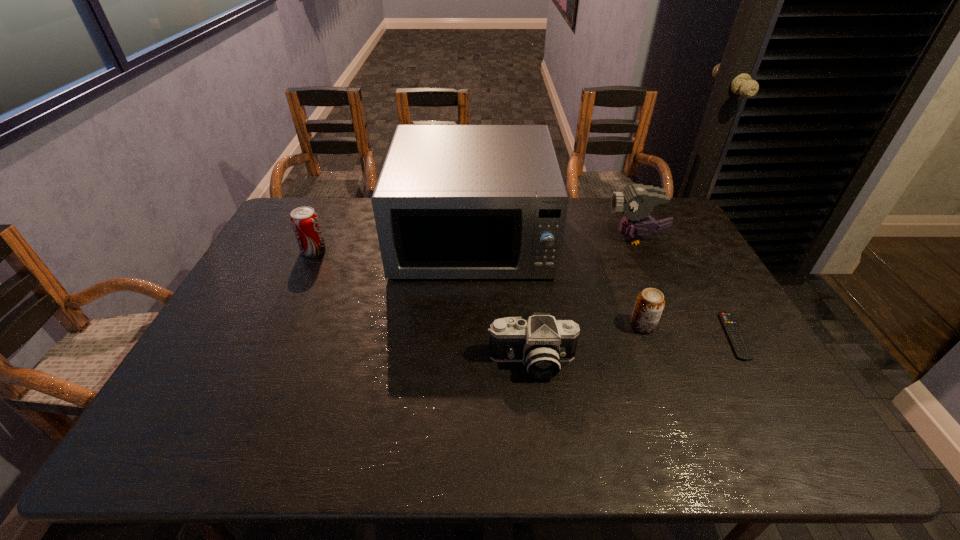
Where is `microwave oven`? The height and width of the screenshot is (540, 960). microwave oven is located at coordinates (452, 201).

In order to click on bird in this screenshot , I will do [637, 201].

Locate an element on the screen. Image resolution: width=960 pixels, height=540 pixels. soda can is located at coordinates (304, 220).

Locate an element on the screen. camera is located at coordinates (541, 342).

Find the location of a particular element. This screenshot has width=960, height=540. beer can is located at coordinates (650, 303).

Locate an element on the screen. This screenshot has height=540, width=960. remote control is located at coordinates (733, 332).

Locate an element on the screen. Image resolution: width=960 pixels, height=540 pixels. the shortest object is located at coordinates (733, 332).

Where is `vacant area situated with the door open on the microwave oven`? vacant area situated with the door open on the microwave oven is located at coordinates (470, 321).

Find the location of a particular element. This screenshot has height=540, width=960. blank space located at the beak of the bird is located at coordinates (556, 239).

Locate an element on the screen. vacant point located at the beak of the bird is located at coordinates (550, 239).